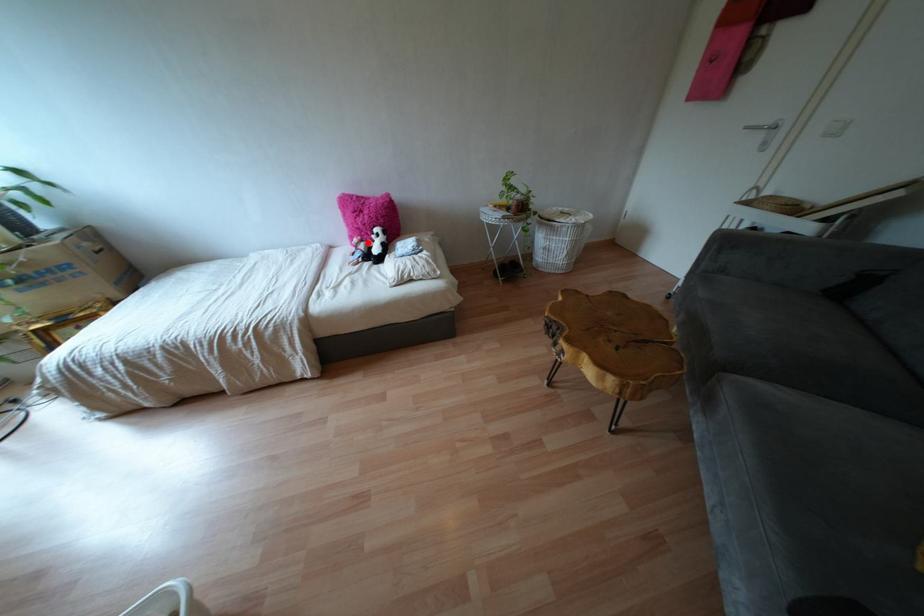
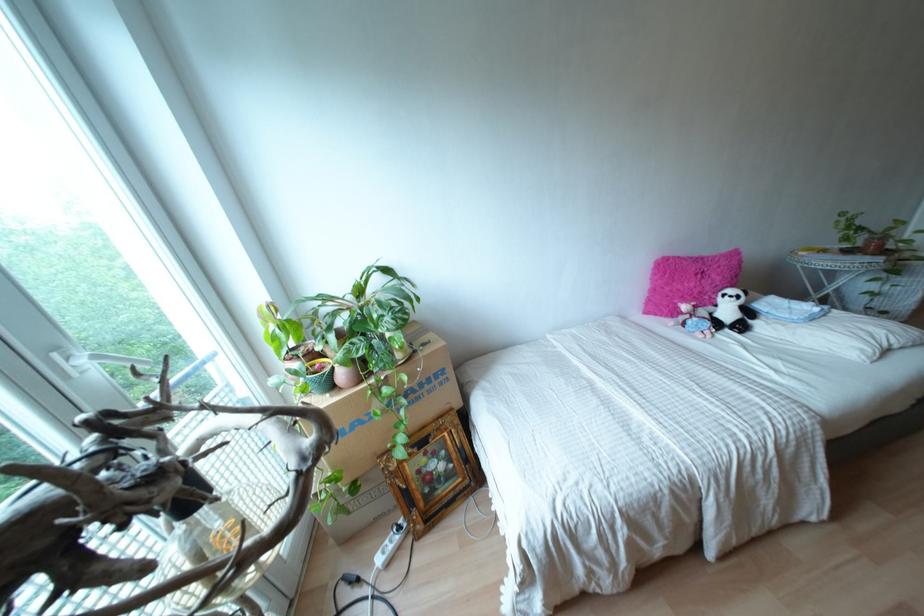
Question: I am providing you with two images of the same scene from different viewpoints. A red point is shown in image1. For the corresponding object point in image2, is it positioned nearer or farther from the camera?

Choices:
 (A) Nearer
 (B) Farther

Answer: (B)